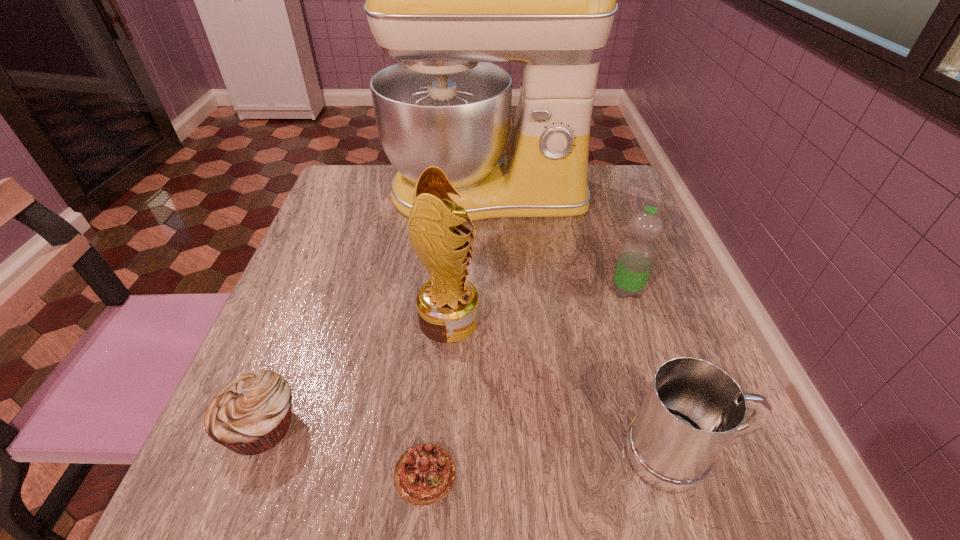
Where is `unoccupied position between the award and the third tallest object`? This screenshot has width=960, height=540. unoccupied position between the award and the third tallest object is located at coordinates (538, 305).

You are a GUI agent. You are given a task and a screenshot of the screen. Output one action in this format:
    pyautogui.click(x=<x>, y=<y>)
    Task: Click on the vacant space that is in between the award and the third shortest object
    
    Given the screenshot: What is the action you would take?
    pyautogui.click(x=565, y=387)

Where is `vacant region between the fourth shortest object and the farthest object`? The width and height of the screenshot is (960, 540). vacant region between the fourth shortest object and the farthest object is located at coordinates (557, 242).

Where is `free area in between the fifth tallest object and the award`? The width and height of the screenshot is (960, 540). free area in between the fifth tallest object and the award is located at coordinates (355, 373).

Identify the location of free area in between the second tallest object and the leftmost object. (355, 373).

Identify the location of vacant region between the fourth shortest object and the mug. Image resolution: width=960 pixels, height=540 pixels. (654, 372).

Where is `blank region between the third shortest object and the muffin`? The image size is (960, 540). blank region between the third shortest object and the muffin is located at coordinates click(471, 440).

This screenshot has height=540, width=960. I want to click on free space between the shortest object and the mug, so click(553, 463).

Find the location of a particular element. The width and height of the screenshot is (960, 540). vacant space that is in between the chocolate cake and the third tallest object is located at coordinates (526, 382).

The width and height of the screenshot is (960, 540). What are the coordinates of `free space between the third tallest object and the award` in the screenshot? It's located at (538, 305).